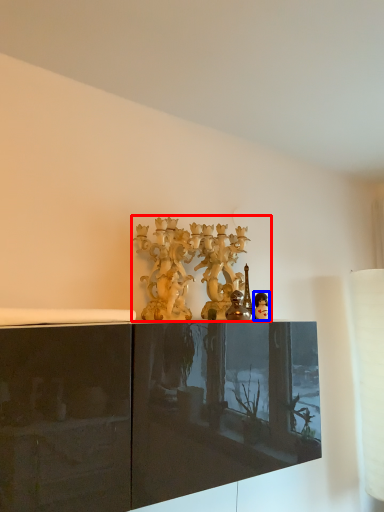
Question: Which object is further to the camera taking this photo, collection (highlighted by a red box) or person (highlighted by a blue box)?

Choices:
 (A) collection
 (B) person

Answer: (A)